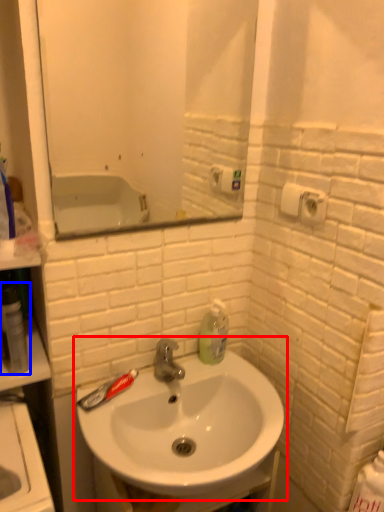
Question: Which of the following is the closest to the observer, sink (highlighted by a red box) or mouthwash (highlighted by a blue box)?

Choices:
 (A) sink
 (B) mouthwash

Answer: (A)